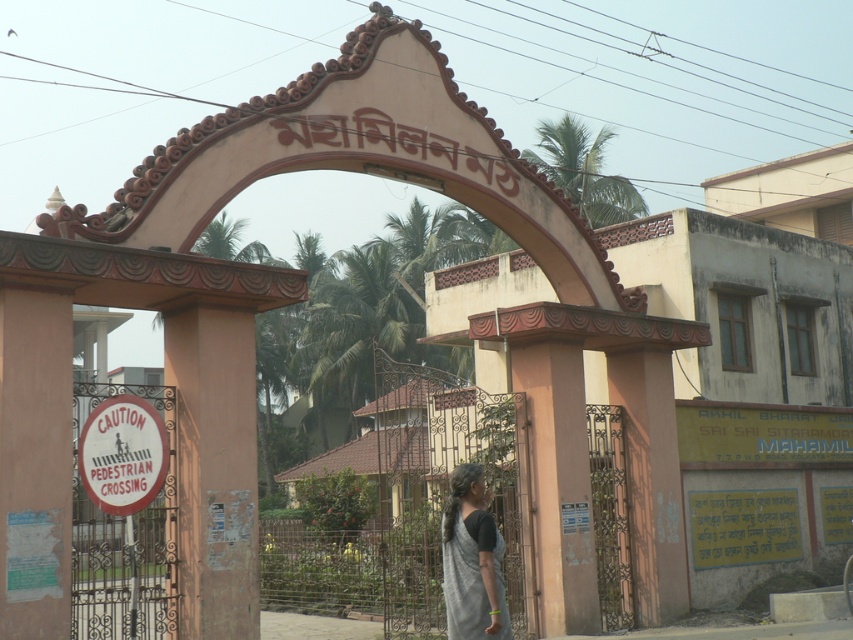
Between beige stone archway at center and black cotton saree at center, which one appears on the right side from the viewer's perspective?

black cotton saree at center is more to the right.

Does point (401, 76) come in front of point (503, 588)?

No, it is not.

Where is `beige stone archway at center`? The height and width of the screenshot is (640, 853). beige stone archway at center is located at coordinates (358, 160).

Is beige stone archway at center thinner than white plastic sign at left?

Indeed, beige stone archway at center has a lesser width compared to white plastic sign at left.

Is point (245, 132) closer to camera compared to point (154, 541)?

No.

In order to click on beige stone archway at center in this screenshot , I will do `click(358, 160)`.

Is black cotton saree at center to the left of white paper sign at lower left from the viewer's perspective?

No, black cotton saree at center is not to the left of white paper sign at lower left.

Does point (456, 509) come behind point (109, 483)?

No.

Which is behind, point (491, 563) or point (138, 472)?

The point (138, 472) is more distant.

Identify the location of black cotton saree at center. (473, 561).